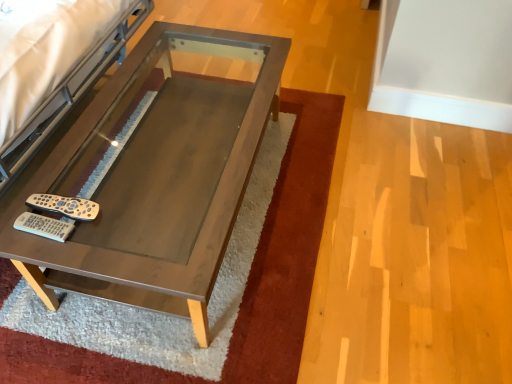
Where is `vacant space to the left of silver metallic remote at lower left`? This screenshot has width=512, height=384. vacant space to the left of silver metallic remote at lower left is located at coordinates (22, 200).